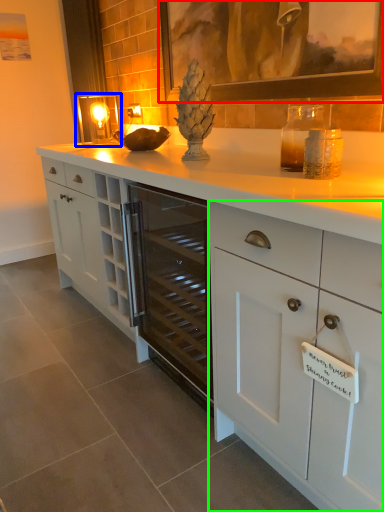
Question: Considering the real-world distances, which object is closest to picture frame (highlighted by a red box)? candle holder (highlighted by a blue box) or cabinetry (highlighted by a green box).

Choices:
 (A) candle holder
 (B) cabinetry

Answer: (B)